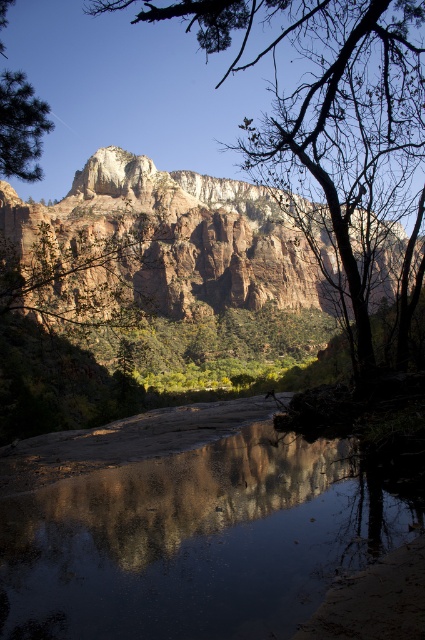
Question: Is the position of smooth reflective water at center less distant than that of rugged sandstone mountain at upper center?

Choices:
 (A) no
 (B) yes

Answer: (B)

Question: From the image, what is the correct spatial relationship of smooth reflective water at center in relation to rugged sandstone mountain at upper center?

Choices:
 (A) above
 (B) below

Answer: (B)

Question: Which object is the farthest from the rugged sandstone mountain at upper center?

Choices:
 (A) green matte tree at upper left
 (B) smooth bark tree at upper center

Answer: (A)

Question: Which object is the farthest from the rugged sandstone mountain at upper center?

Choices:
 (A) smooth bark tree at upper center
 (B) green matte tree at upper left

Answer: (B)

Question: Which of the following is the farthest from the observer?

Choices:
 (A) (36, 163)
 (B) (393, 232)
 (C) (133, 582)

Answer: (B)

Question: Observing the image, what is the correct spatial positioning of smooth reflective water at center in reference to green matte tree at upper left?

Choices:
 (A) right
 (B) left

Answer: (A)